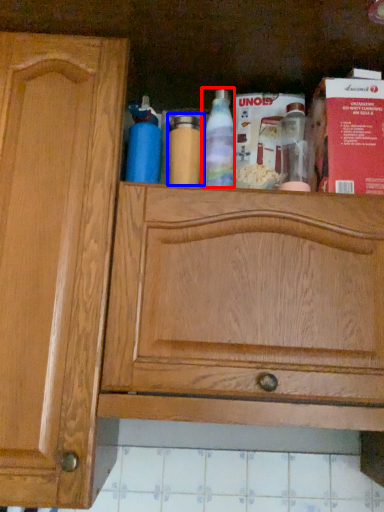
Question: Which object appears closest to the camera in this image, bottle (highlighted by a red box) or bottle (highlighted by a blue box)?

Choices:
 (A) bottle
 (B) bottle

Answer: (A)